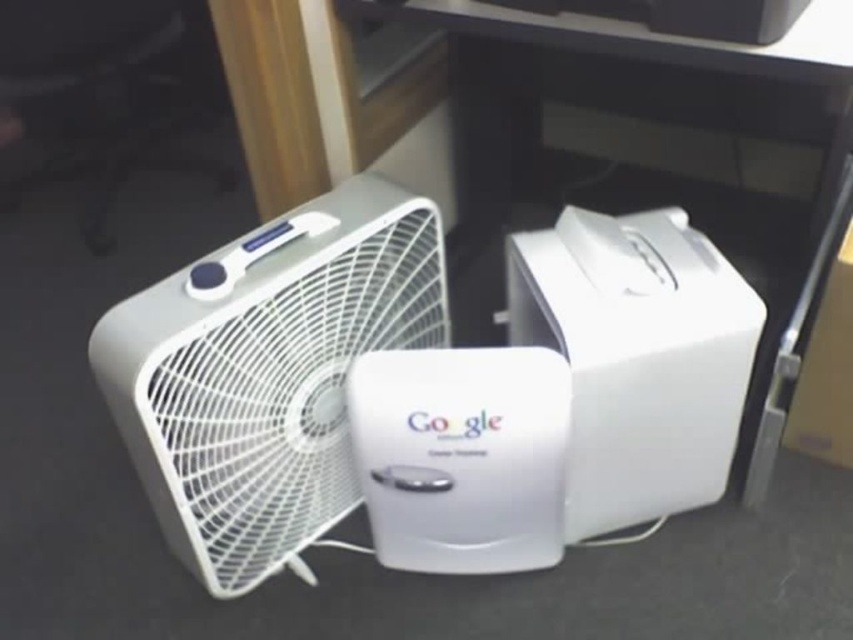
Does white plastic computer desk at center have a smaller size compared to white plastic fan at center?

No.

Does white plastic computer desk at center appear on the right side of white plastic fan at center?

Yes, white plastic computer desk at center is to the right of white plastic fan at center.

Find the location of a particular element. The height and width of the screenshot is (640, 853). white plastic computer desk at center is located at coordinates (653, 163).

Locate an element on the screen. white plastic computer desk at center is located at coordinates (653, 163).